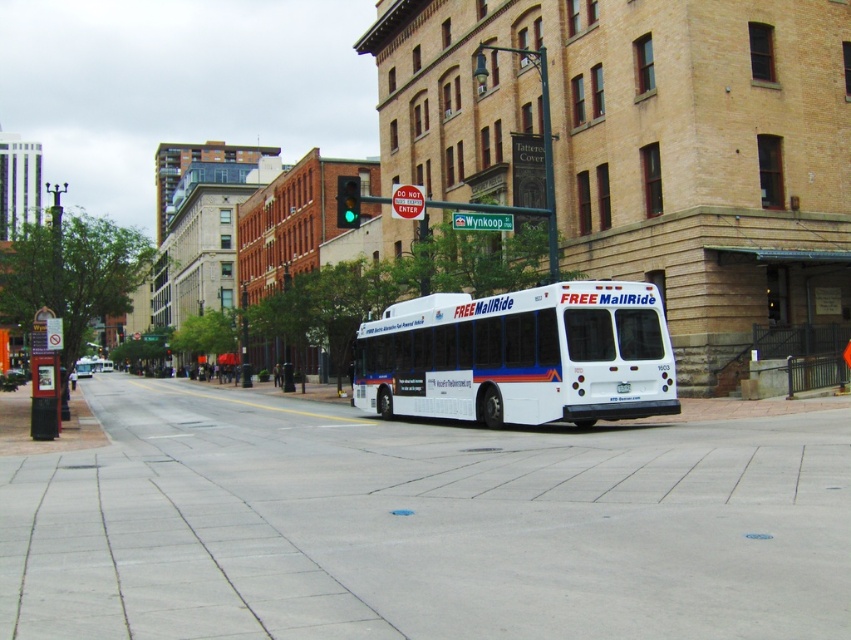
Question: Which point is closer to the camera?

Choices:
 (A) white matte bus at center
 (B) metallic sign at left

Answer: (A)

Question: Can you confirm if gray concrete pavement at center is smaller than metallic sign at left?

Choices:
 (A) no
 (B) yes

Answer: (A)

Question: Does gray concrete pavement at center appear on the left side of metallic sign at left?

Choices:
 (A) yes
 (B) no

Answer: (B)

Question: Can you confirm if gray concrete pavement at center is positioned below metallic sign at left?

Choices:
 (A) yes
 (B) no

Answer: (A)

Question: Among these objects, which one is farthest from the camera?

Choices:
 (A) white matte bus at center
 (B) metallic sign at left
 (C) gray concrete pavement at center

Answer: (B)

Question: Which object is farther from the camera taking this photo?

Choices:
 (A) metallic sign at left
 (B) gray concrete pavement at center

Answer: (A)